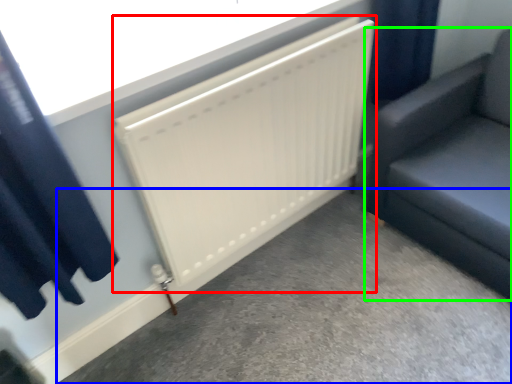
Question: Which is farther away from radiator (highlighted by a red box)? concrete (highlighted by a blue box) or furniture (highlighted by a green box)?

Choices:
 (A) concrete
 (B) furniture

Answer: (A)